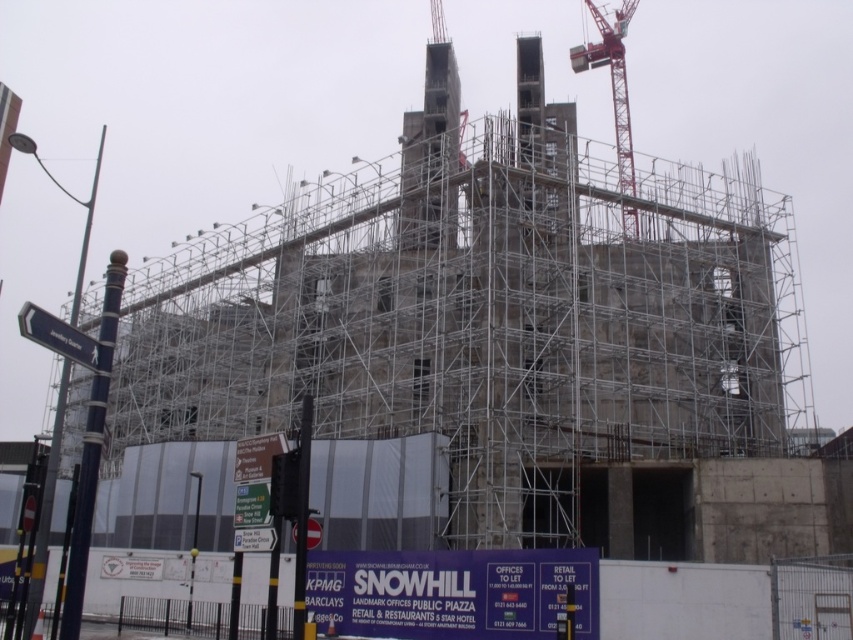
Question: Which point is closer to the camera taking this photo?

Choices:
 (A) (592, 61)
 (B) (33, 317)

Answer: (B)

Question: Which point is closer to the camera taking this photo?

Choices:
 (A) (608, 36)
 (B) (91, 342)

Answer: (B)

Question: Which point is closer to the camera taking this photo?

Choices:
 (A) (26, 314)
 (B) (595, 54)

Answer: (A)

Question: Is red metal crane at upper right smaller than white plastic street sign at left?

Choices:
 (A) no
 (B) yes

Answer: (B)

Question: Can you confirm if red metal crane at upper right is bigger than white plastic street sign at left?

Choices:
 (A) no
 (B) yes

Answer: (A)

Question: Is red metal crane at upper right to the left of white plastic street sign at left from the viewer's perspective?

Choices:
 (A) no
 (B) yes

Answer: (A)